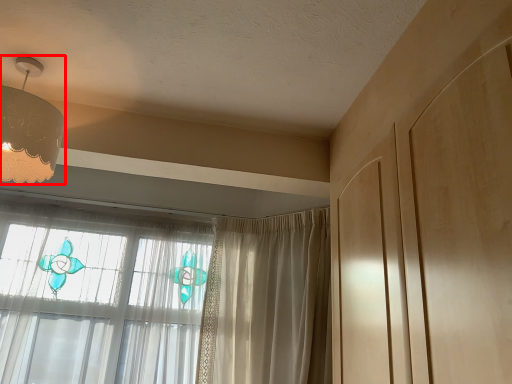
Question: Considering the relative positions of lamp (annotated by the red box) and curtain in the image provided, where is lamp (annotated by the red box) located with respect to the staircase?

Choices:
 (A) right
 (B) left

Answer: (B)